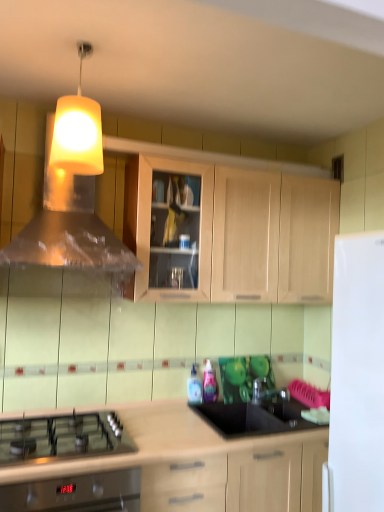
I want to click on free spot above yellow matte lampshade at upper center (from a real-world perspective), so click(x=85, y=44).